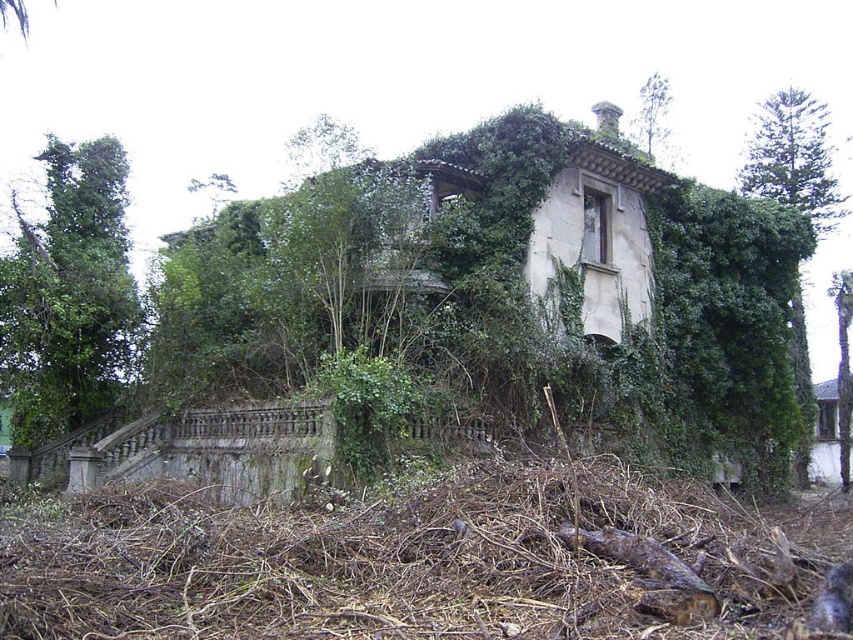
You are standing at the base of the stone steps in front of the abandoned building. You notice two green leafy trees in the scene. Which tree, the green leafy tree at right or the green leafy tree at upper center, would cast a longer shadow if the sun is directly overhead?

The green leafy tree at right is much taller than the green leafy tree at upper center, so it would cast a longer shadow when the sun is directly overhead.

You are a hiker who has stumbled upon this abandoned building. You notice brown wood debris at lower center and a green leafy tree at upper center. Which object is positioned to the left of the other?

A: The brown wood debris at lower center is to the left of green leafy tree at upper center.

You are standing at the point labeled as point (68, 292) in the image. What object is located to your immediate left?

The green leafy tree at left is located to your immediate left.